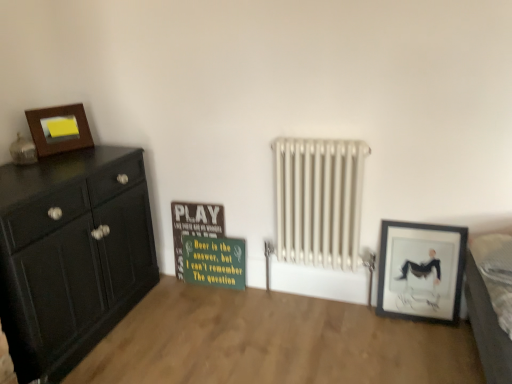
Question: From a real-world perspective, is matte black picture frame at lower right, which ranks as the first picture frame in right-to-left order, physically located above or below gray fabric bed at lower right?

Choices:
 (A) above
 (B) below

Answer: (B)

Question: Considering the positions of matte black picture frame at lower right, the 1th picture frame when ordered from bottom to top, and gray fabric bed at lower right in the image, is matte black picture frame at lower right, the 1th picture frame when ordered from bottom to top, taller or shorter than gray fabric bed at lower right?

Choices:
 (A) short
 (B) tall

Answer: (B)

Question: Which object is positioned farthest from the matte black cabinet at left?

Choices:
 (A) matte wooden picture frame at upper left, the 2th picture frame from the bottom
 (B) green matte signboard at center
 (C) gray fabric bed at lower right
 (D) wooden signboard at center
 (E) white metallic radiator at center

Answer: (C)

Question: Estimate the real-world distances between objects in this image. Which object is closer to the wooden signboard at center?

Choices:
 (A) white metallic radiator at center
 (B) matte wooden picture frame at upper left, placed as the first picture frame when sorted from top to bottom
 (C) matte black picture frame at lower right, which ranks as the first picture frame in right-to-left order
 (D) matte black cabinet at left
 (E) green matte signboard at center

Answer: (E)